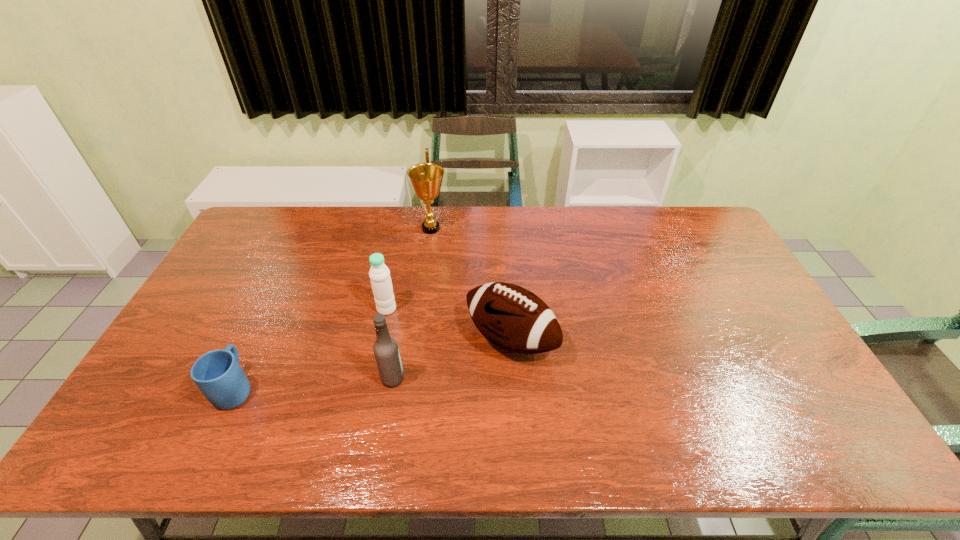
Where is `free space located on the front of the rightmost object`? This screenshot has height=540, width=960. free space located on the front of the rightmost object is located at coordinates (516, 415).

At what (x,y) coordinates should I click in order to perform the action: click on vacant space situated on the side of the shortest object with the handle. Please return your answer as a coordinate pair (x, y). Looking at the image, I should click on (258, 340).

Find the location of `free spot located on the side of the shortest object with the handle`. free spot located on the side of the shortest object with the handle is located at coordinates (289, 275).

Find the location of `vacant space located on the side of the shortest object with the handle`. vacant space located on the side of the shortest object with the handle is located at coordinates (282, 288).

Locate an element on the screen. This screenshot has width=960, height=540. object at the far edge is located at coordinates (426, 178).

In the image, there is a desktop. Identify the location of vacant space at the far edge. (625, 228).

In order to click on free point at the near edge in this screenshot , I will do `click(708, 426)`.

In the image, there is a desktop. At what (x,y) coordinates should I click in order to perform the action: click on vacant space at the left edge. Please return your answer as a coordinate pair (x, y). Looking at the image, I should click on (210, 311).

In the image, there is a desktop. At what (x,y) coordinates should I click in order to perform the action: click on free space at the right edge. Please return your answer as a coordinate pair (x, y). Image resolution: width=960 pixels, height=540 pixels. Looking at the image, I should click on (769, 367).

Image resolution: width=960 pixels, height=540 pixels. Find the location of `vacant space at the far left corner of the desktop`. vacant space at the far left corner of the desktop is located at coordinates (257, 227).